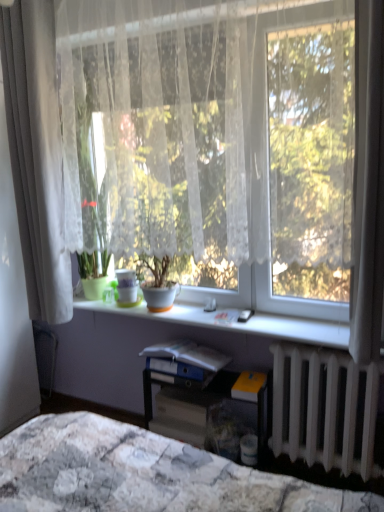
Find the location of `vacant space positioned to the left of black plastic remote control at center`. vacant space positioned to the left of black plastic remote control at center is located at coordinates (217, 317).